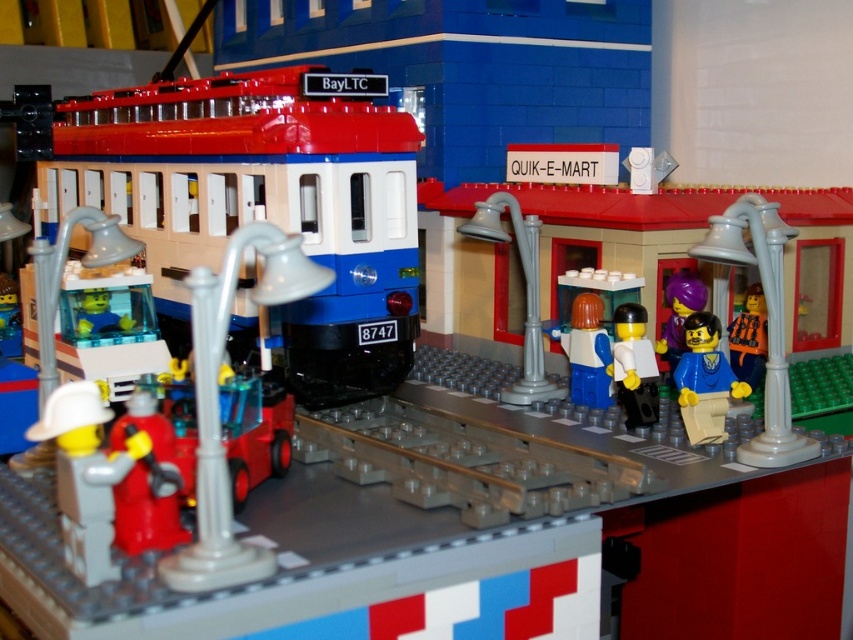
Does red matte firefighter at lower left have a greater width compared to purple matte figure at center-right?

Yes, red matte firefighter at lower left is wider than purple matte figure at center-right.

Who is taller, red matte firefighter at lower left or purple matte figure at center-right?

With more height is red matte firefighter at lower left.

Is point (90, 387) farther from camera compared to point (689, 307)?

No, it is not.

Find the location of a particular element. The width and height of the screenshot is (853, 640). red matte firefighter at lower left is located at coordinates (85, 476).

Is smooth plastic train at center above red matte firefighter at lower left?

Correct, smooth plastic train at center is located above red matte firefighter at lower left.

Does smooth plastic train at center have a lesser width compared to red matte firefighter at lower left?

In fact, smooth plastic train at center might be wider than red matte firefighter at lower left.

Is point (142, 147) positioned in front of point (62, 387)?

No, (142, 147) is behind (62, 387).

Where is `smooth plastic train at center`? The image size is (853, 640). smooth plastic train at center is located at coordinates (260, 204).

Between point (619, 400) and point (753, 362), which one is positioned behind?

The point (753, 362) is behind.

Which of these two, white plastic minifigure at center-right or orange plastic figure at center right, stands taller?

With more height is white plastic minifigure at center-right.

The height and width of the screenshot is (640, 853). Describe the element at coordinates (634, 365) in the screenshot. I see `white plastic minifigure at center-right` at that location.

The image size is (853, 640). I want to click on white plastic minifigure at center-right, so pyautogui.click(x=634, y=365).